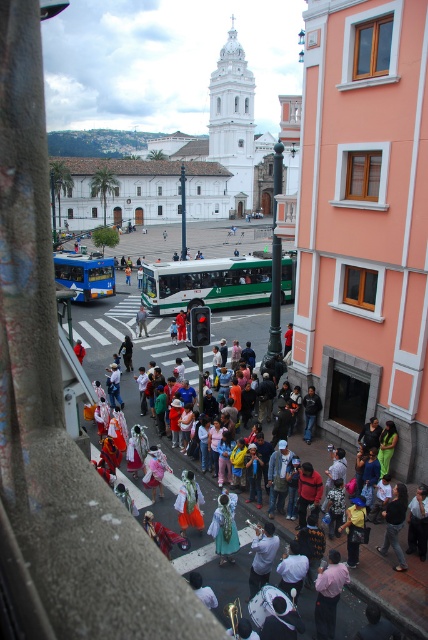
Question: Is green matte bus at center wider than pink fabric dress at lower center?

Choices:
 (A) no
 (B) yes

Answer: (B)

Question: Is pink fabric dress at lower center positioned behind red fabric bag at center?

Choices:
 (A) yes
 (B) no

Answer: (B)

Question: Which is farther from the light blue fabric at center?

Choices:
 (A) green fabric dress at center
 (B) white cotton dress at center

Answer: (B)

Question: Which point is closer to the camera?

Choices:
 (A) (342, 584)
 (B) (82, 349)
 (C) (243, 266)

Answer: (A)

Question: Which object appears farthest from the camera in this image?

Choices:
 (A) pink fabric dress at lower center
 (B) green matte bus at center

Answer: (B)

Question: Considering the relative positions of green fabric dress at center and light blue fabric at center in the image provided, where is green fabric dress at center located with respect to light blue fabric at center?

Choices:
 (A) left
 (B) right

Answer: (B)